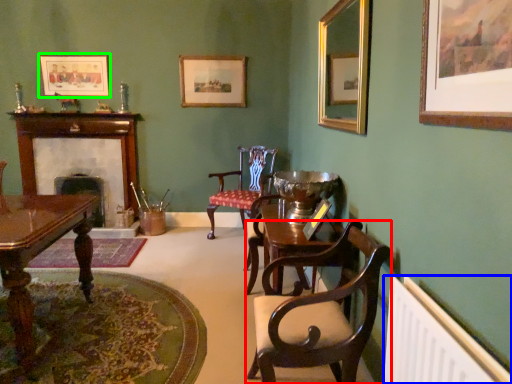
Question: Which object is the farthest from chair (highlighted by a red box)? Choose among these: radiator (highlighted by a blue box) or picture frame (highlighted by a green box).

Choices:
 (A) radiator
 (B) picture frame

Answer: (B)